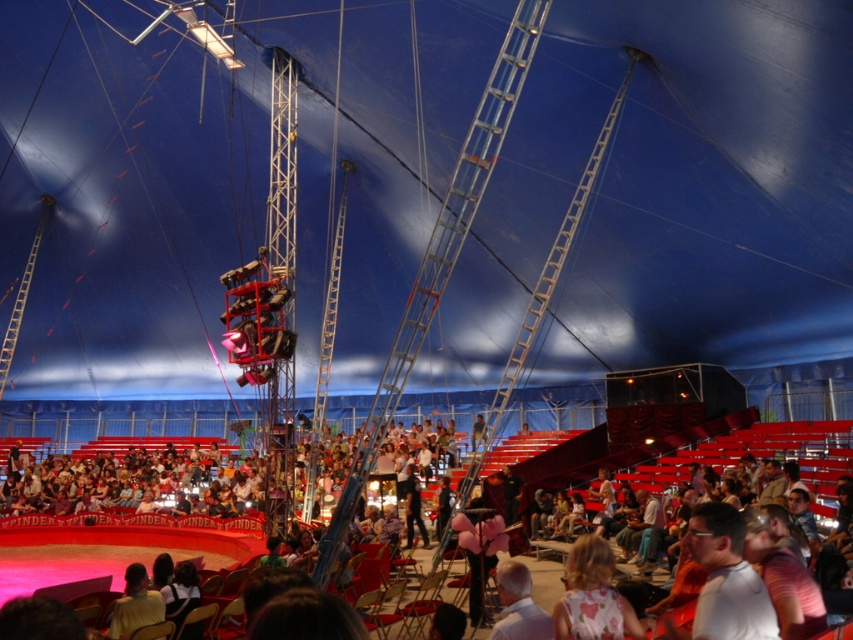
Question: Does floral fabric dress at center lie in front of white matte shirt at lower center?

Choices:
 (A) yes
 (B) no

Answer: (A)

Question: Does floral fabric dress at center have a smaller size compared to light brown hair at lower center?

Choices:
 (A) no
 (B) yes

Answer: (B)

Question: Which of the following is the farthest from the observer?

Choices:
 (A) (497, 570)
 (B) (136, 611)

Answer: (A)

Question: Which of the following is the closest to the observer?

Choices:
 (A) (141, 570)
 (B) (523, 566)

Answer: (B)

Question: Which object is farther from the camera taking this photo?

Choices:
 (A) floral fabric dress at center
 (B) light brown hair at lower center
 (C) white matte shirt at lower center

Answer: (B)

Question: Does white matte shirt at lower center appear under light brown hair at lower center?

Choices:
 (A) no
 (B) yes

Answer: (A)